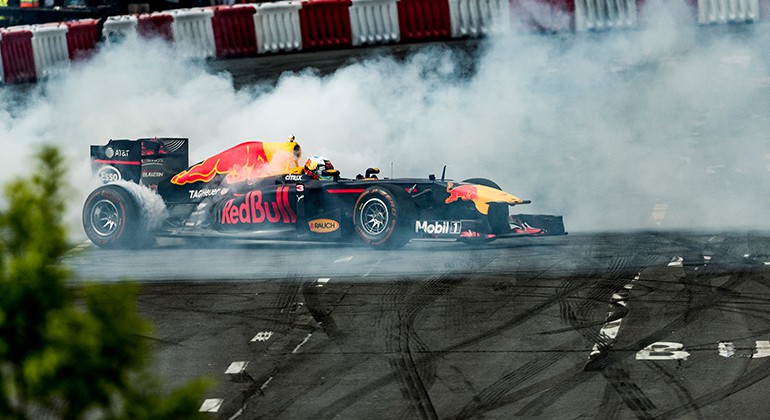
In order to click on white wall in this screenshot , I will do `click(52, 44)`, `click(198, 29)`, `click(270, 24)`, `click(385, 19)`, `click(484, 7)`, `click(620, 0)`, `click(731, 7)`.